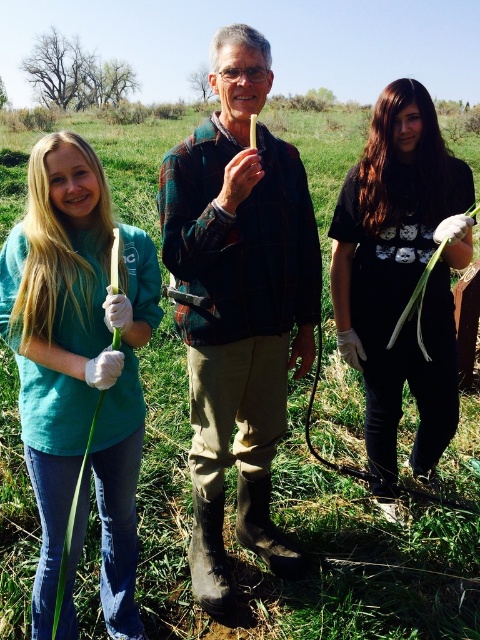
You are a photographer standing at the camera position. You want to take a photo of the green matte plant at center so that it appears larger in the photo. What should you do?

Move closer to the green matte plant at center to make it appear larger in the photo.